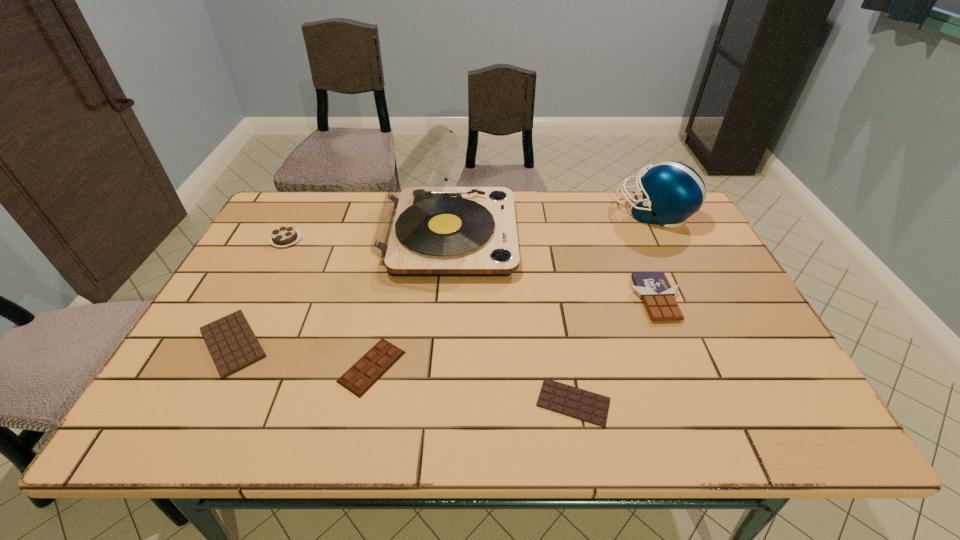
Image resolution: width=960 pixels, height=540 pixels. I want to click on vacant space that is in between the tallest chocolate bar and the third chocolate bar from right to left, so click(514, 333).

Locate an element on the screen. The height and width of the screenshot is (540, 960). vacant region between the tallest object and the fifth tallest object is located at coordinates (411, 301).

Choose which object is the fourth nearest neighbor to the rightmost chocolate bar. Please provide its 2D coordinates. Your answer should be formatted as a tuple, i.e. [(x, y)], where the tuple contains the x and y coordinates of a point satisfying the conditions above.

[(382, 356)]

Identify which object is the sixth nearest to the shortest object. Please provide its 2D coordinates. Your answer should be formatted as a tuple, i.e. [(x, y)], where the tuple contains the x and y coordinates of a point satisfying the conditions above.

[(283, 236)]

Select which chocolate bar appears as the second closest to the second tallest object. Please provide its 2D coordinates. Your answer should be formatted as a tuple, i.e. [(x, y)], where the tuple contains the x and y coordinates of a point satisfying the conditions above.

[(574, 402)]

Where is `chocolate bar that is the second closest to the shortest object`? chocolate bar that is the second closest to the shortest object is located at coordinates (382, 356).

Identify the location of free space that satisfies the following two spatial constraints: 1. with the tonearm facing the front of the record player; 2. on the right side of the tallest chocolate bar. (444, 299).

Identify the location of vacant space that satisfies the following two spatial constraints: 1. at the front of the sixth shortest object with the faceguard; 2. on the front side of the chocolate cake. The image size is (960, 540). (666, 240).

Identify the location of vacant space that satisfies the following two spatial constraints: 1. with the tonearm facing the front of the tallest chocolate bar; 2. on the left side of the tallest object. (444, 299).